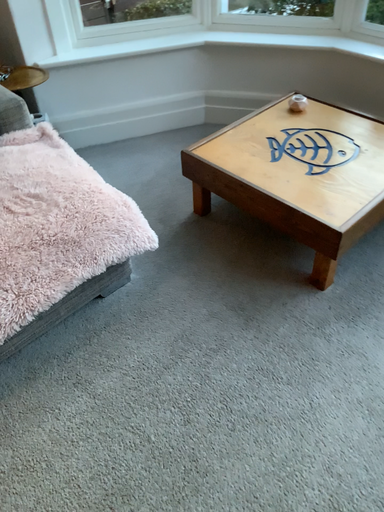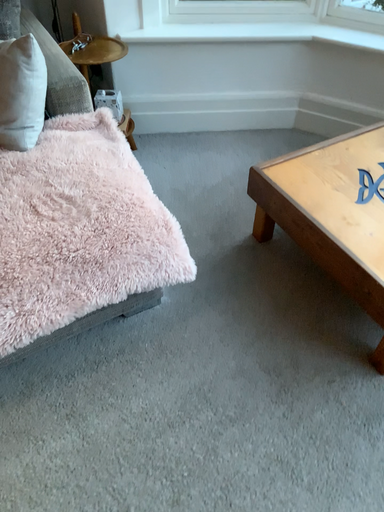
Question: Which way did the camera rotate in the video?

Choices:
 (A) rotated right
 (B) rotated left

Answer: (B)